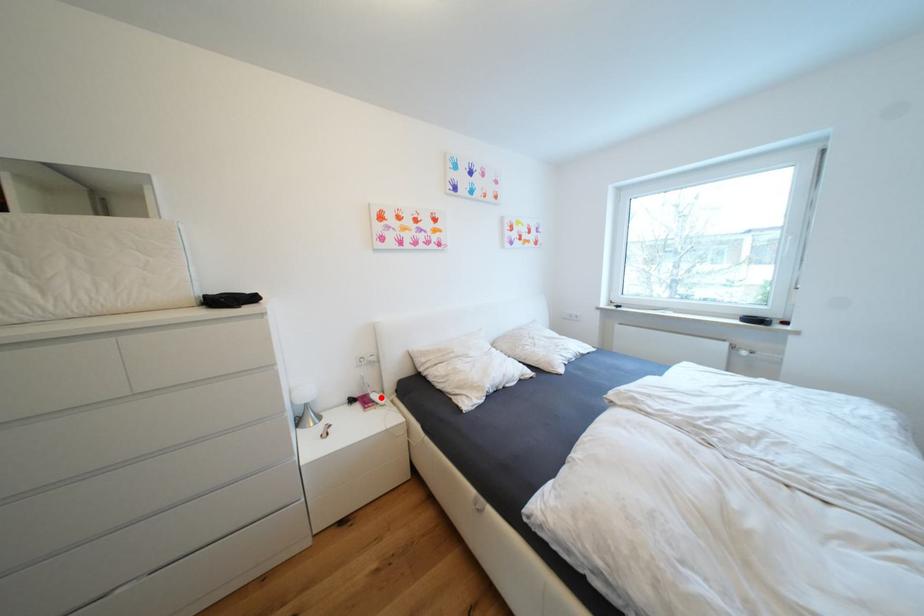
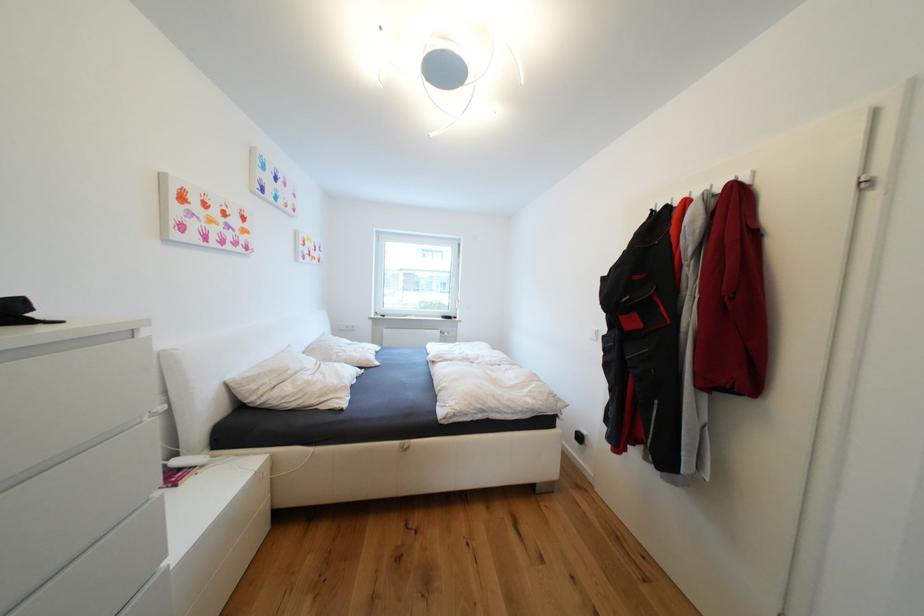
Question: I am providing you with two images of the same scene from different viewpoints. Image1 has a red point marked. In image2, the corresponding 3D location appears at what relative position? Reply with the corresponding letter.

Choices:
 (A) Closer
 (B) Farther

Answer: (A)